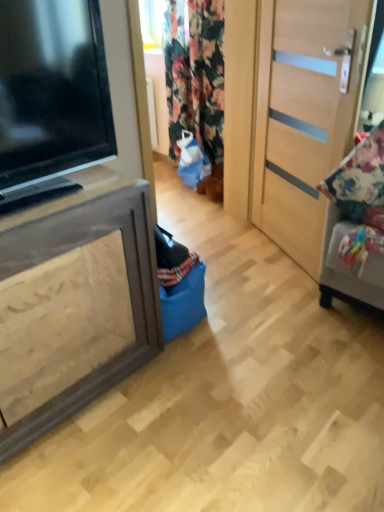
Question: Do you think black glossy television at left is within floral fabric cushion at right, or outside of it?

Choices:
 (A) outside
 (B) inside

Answer: (A)

Question: Is black glossy television at left in front of or behind floral fabric cushion at right in the image?

Choices:
 (A) behind
 (B) front

Answer: (B)

Question: Which object is the farthest from the floral fabric curtain at center?

Choices:
 (A) floral fabric cushion at right
 (B) black glossy television at left
 (C) light wood door at right
 (D) brown wood cabinet at left

Answer: (D)

Question: Estimate the real-world distances between objects in this image. Which object is closer to the floral fabric cushion at right?

Choices:
 (A) floral fabric curtain at center
 (B) brown wood cabinet at left
 (C) black glossy television at left
 (D) light wood door at right

Answer: (D)